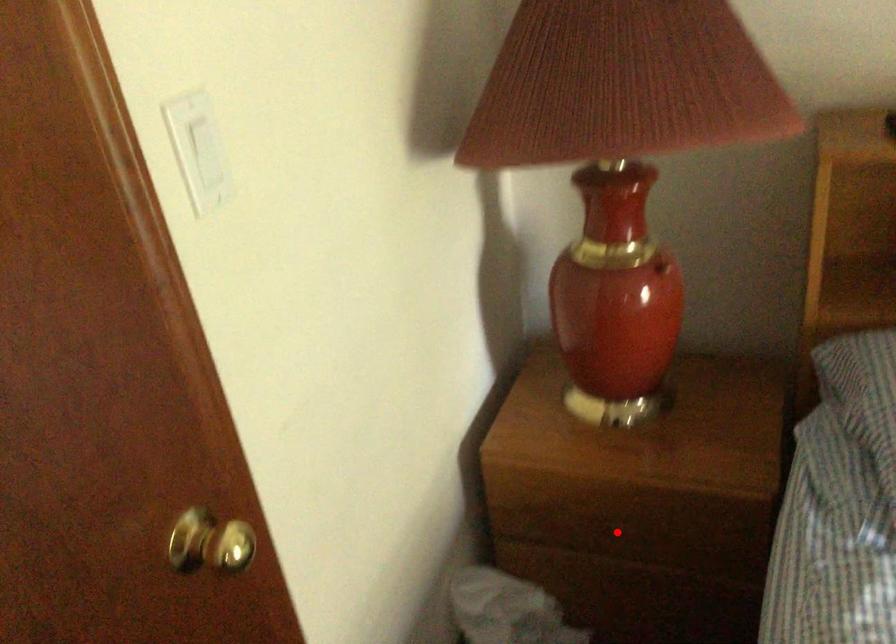
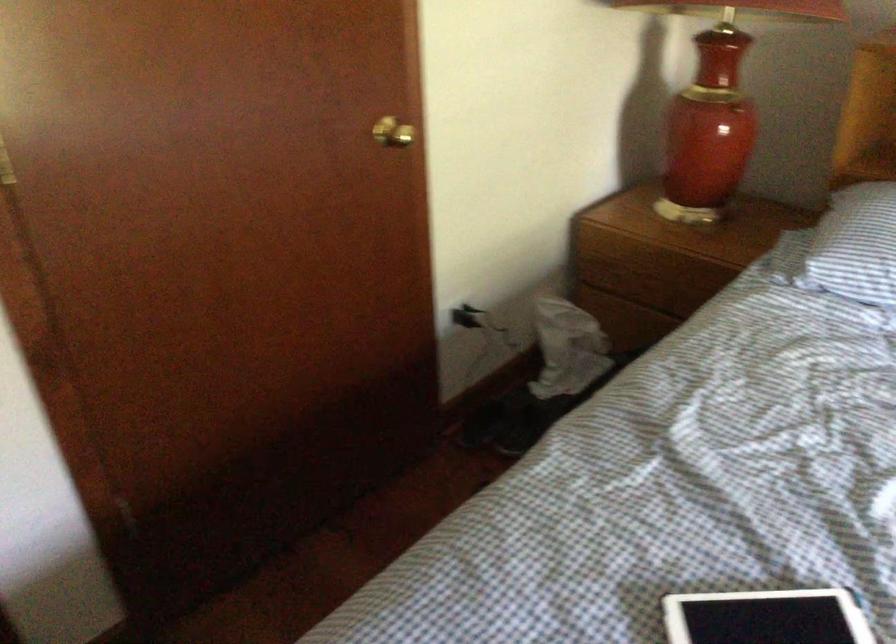
Where in the second image is the point corresponding to the highlighted location from the first image?

(650, 283)